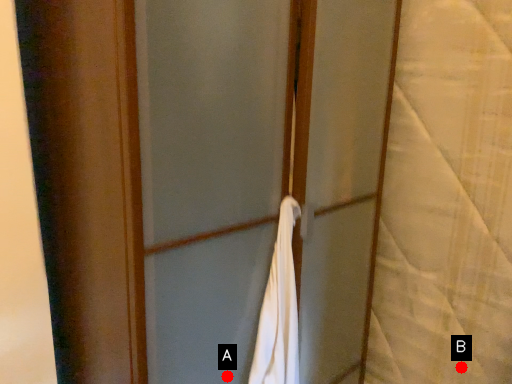
Question: Two points are circled on the image, labeled by A and B beside each circle. Among these points, which one is nearest to the camera?

Choices:
 (A) A is closer
 (B) B is closer

Answer: (A)